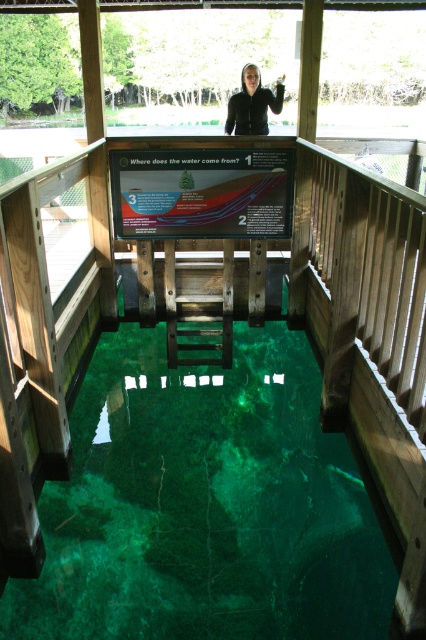
You are standing on the observation deck and want to take a photo of the green translucent water at center. Where should you aim your camera to capture it?

You should aim your camera at point (204, 506) to capture the green translucent water at center.

You are standing at the point marked as point (186, 564) on the observation deck. You want to take a photo of the woman holding something small in her hand. Is the woman within your camera range if your camera has a maximum focus distance of 4 meters?

The distance of point (186, 564) from the camera is 3.93 meters. Since the camera can focus up to 4 meters, the woman is within the camera range and can be photographed clearly.